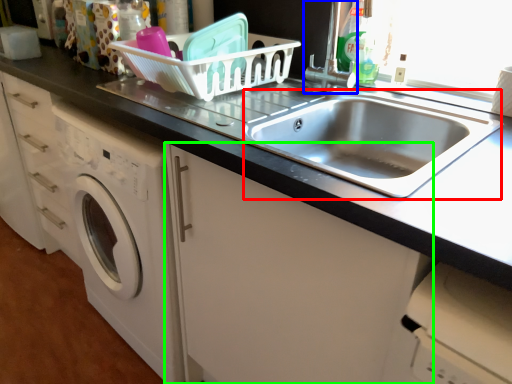
Question: Estimate the real-world distances between objects in this image. Which object is closer to sink (highlighted by a red box), faucet (highlighted by a blue box) or cabinetry (highlighted by a green box)?

Choices:
 (A) faucet
 (B) cabinetry

Answer: (A)